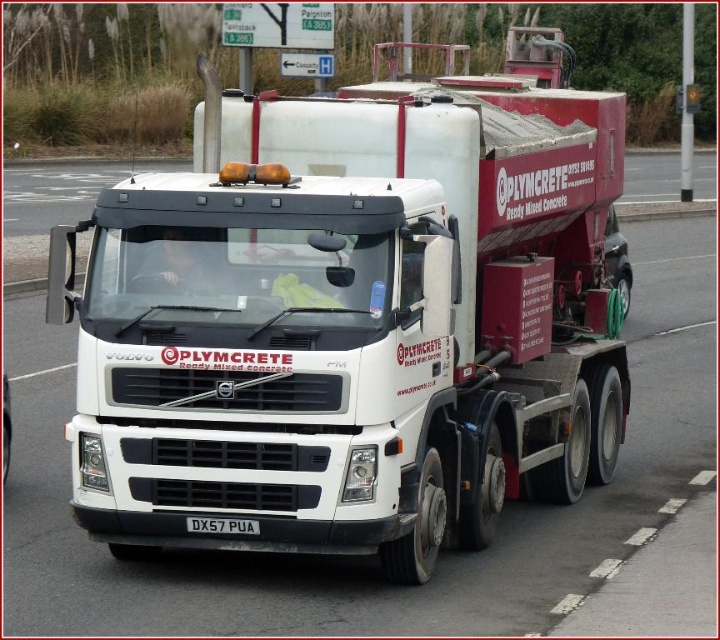
Is white matte concrete mixer at center wider than white plastic license plate at center?

No, white matte concrete mixer at center is not wider than white plastic license plate at center.

Can you confirm if white matte concrete mixer at center is positioned to the left of white plastic license plate at center?

Yes, white matte concrete mixer at center is to the left of white plastic license plate at center.

Describe the element at coordinates (350, 321) in the screenshot. I see `white matte concrete mixer at center` at that location.

Locate an element on the screen. Image resolution: width=720 pixels, height=640 pixels. white matte concrete mixer at center is located at coordinates [350, 321].